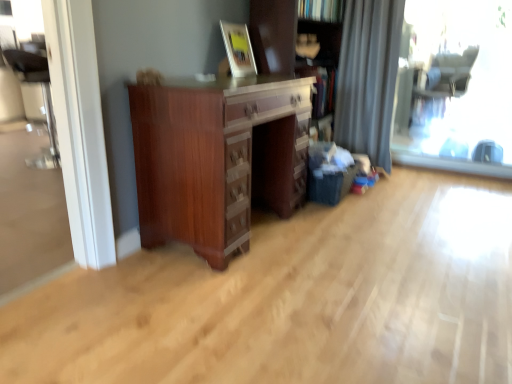
Question: Does mahogany wood chest of drawers at center turn towards wooden bookcase at center?

Choices:
 (A) no
 (B) yes

Answer: (A)

Question: Considering the relative sizes of mahogany wood chest of drawers at center and wooden bookcase at center in the image provided, is mahogany wood chest of drawers at center bigger than wooden bookcase at center?

Choices:
 (A) yes
 (B) no

Answer: (B)

Question: Is mahogany wood chest of drawers at center not within wooden bookcase at center?

Choices:
 (A) yes
 (B) no

Answer: (A)

Question: Is mahogany wood chest of drawers at center further to camera compared to wooden bookcase at center?

Choices:
 (A) yes
 (B) no

Answer: (B)

Question: Is mahogany wood chest of drawers at center in front of wooden bookcase at center?

Choices:
 (A) yes
 (B) no

Answer: (A)

Question: Is transparent glass window at right spatially inside mahogany wood chest of drawers at center, or outside of it?

Choices:
 (A) inside
 (B) outside

Answer: (B)

Question: Looking at the image, does transparent glass window at right seem bigger or smaller compared to mahogany wood chest of drawers at center?

Choices:
 (A) big
 (B) small

Answer: (B)

Question: In the image, is transparent glass window at right on the left side or the right side of mahogany wood chest of drawers at center?

Choices:
 (A) right
 (B) left

Answer: (A)

Question: Is transparent glass window at right in front of or behind mahogany wood chest of drawers at center in the image?

Choices:
 (A) behind
 (B) front

Answer: (A)

Question: Is mahogany wood chest of drawers at center bigger or smaller than wooden picture frame at upper center?

Choices:
 (A) big
 (B) small

Answer: (A)

Question: Do you think mahogany wood chest of drawers at center is within wooden picture frame at upper center, or outside of it?

Choices:
 (A) outside
 (B) inside

Answer: (A)

Question: From a real-world perspective, is mahogany wood chest of drawers at center positioned above or below wooden picture frame at upper center?

Choices:
 (A) below
 (B) above

Answer: (A)

Question: From the image's perspective, is mahogany wood chest of drawers at center above or below wooden picture frame at upper center?

Choices:
 (A) below
 (B) above

Answer: (A)

Question: Visually, is transparent glass window at right positioned to the left or to the right of gray fabric curtain at right?

Choices:
 (A) left
 (B) right

Answer: (B)

Question: Is transparent glass window at right bigger or smaller than gray fabric curtain at right?

Choices:
 (A) big
 (B) small

Answer: (B)